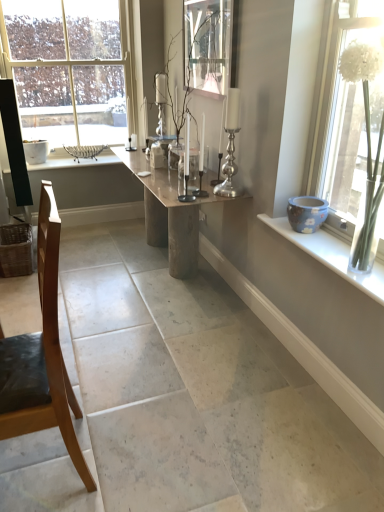
At what (x,y) coordinates should I click in order to perform the action: click on free point below light wood chair at left (from a real-world perspective). Please return your answer as a coordinate pair (x, y). The height and width of the screenshot is (512, 384). Looking at the image, I should click on (37, 473).